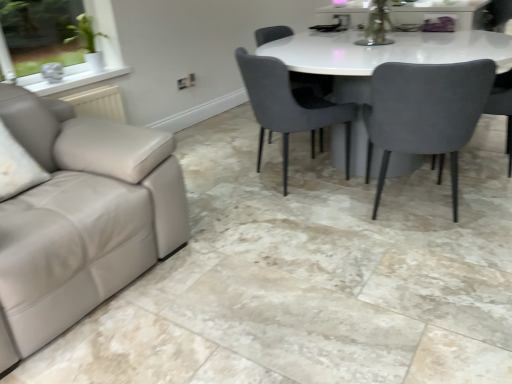
Locate an element on the screen. The height and width of the screenshot is (384, 512). free space below suede gray chair at right, marked as the 2th chair in a right-to-left arrangement (from a real-world perspective) is located at coordinates (410, 210).